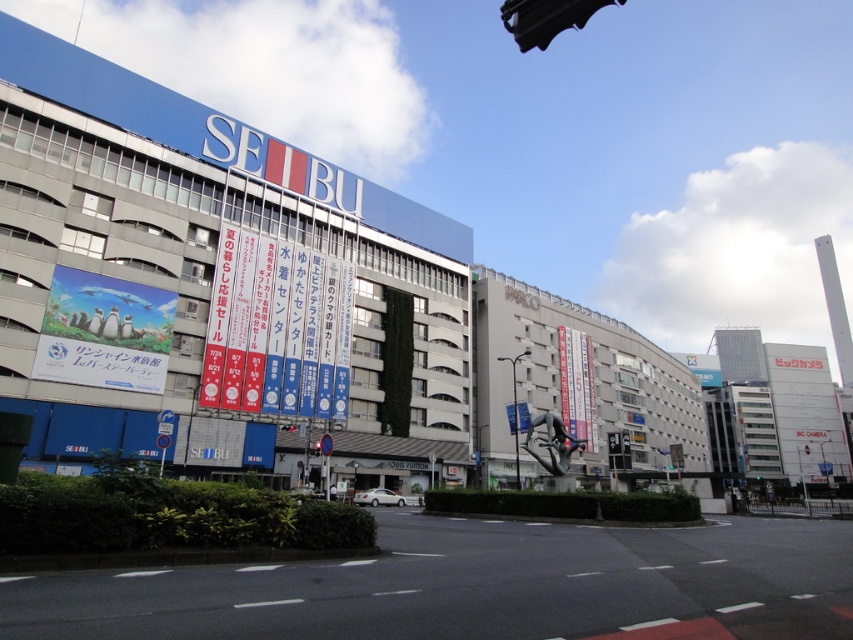
What do you see at coordinates (277, 328) in the screenshot? I see `white paper banners at center` at bounding box center [277, 328].

Locate an element on the screen. The width and height of the screenshot is (853, 640). white paper banners at center is located at coordinates (277, 328).

What are the coordinates of `white paper banners at center` in the screenshot? It's located at (277, 328).

Which is above, white paper banners at center or black plastic traffic light at upper center?

white paper banners at center

Image resolution: width=853 pixels, height=640 pixels. What do you see at coordinates (277, 328) in the screenshot? I see `white paper banners at center` at bounding box center [277, 328].

Is point (212, 340) behind point (283, 426)?

That is False.

Find the location of a particular element. The width and height of the screenshot is (853, 640). white paper banners at center is located at coordinates (277, 328).

Is point (293, 426) farther from camera compared to point (316, 445)?

Yes, point (293, 426) is behind point (316, 445).

What do you see at coordinates (286, 428) in the screenshot?
I see `black plastic traffic light at upper center` at bounding box center [286, 428].

What are the coordinates of `black plastic traffic light at upper center` in the screenshot? It's located at (286, 428).